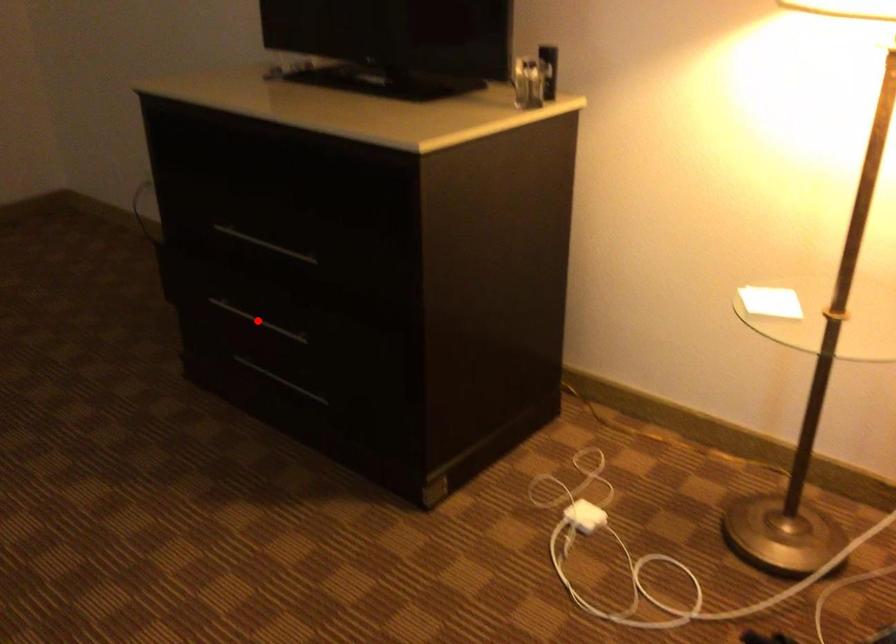
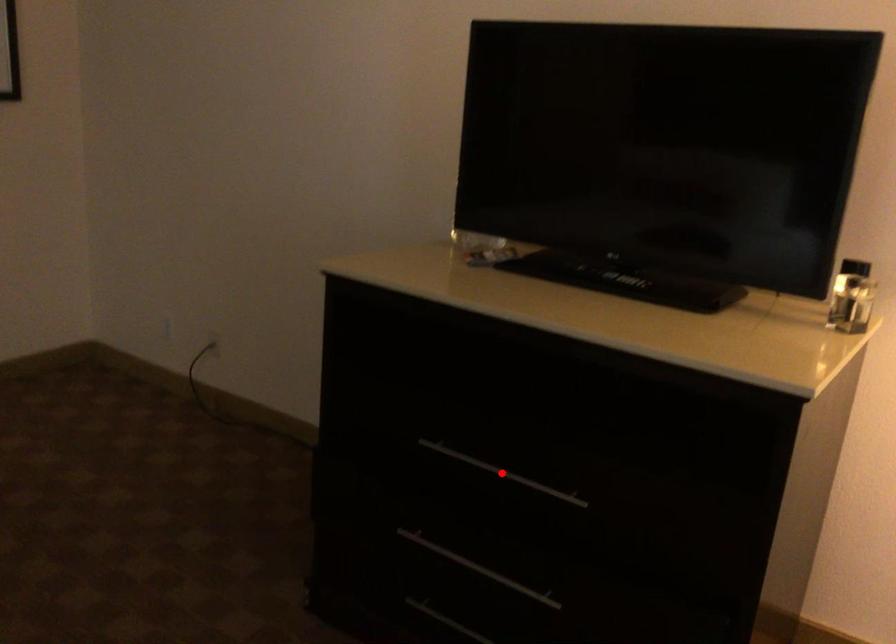
I am providing you with two images of the same scene from different viewpoints. A red point is marked on the first image and another point is marked on the second image. Does the point marked in image1 correspond to the same location as the one in image2?

No